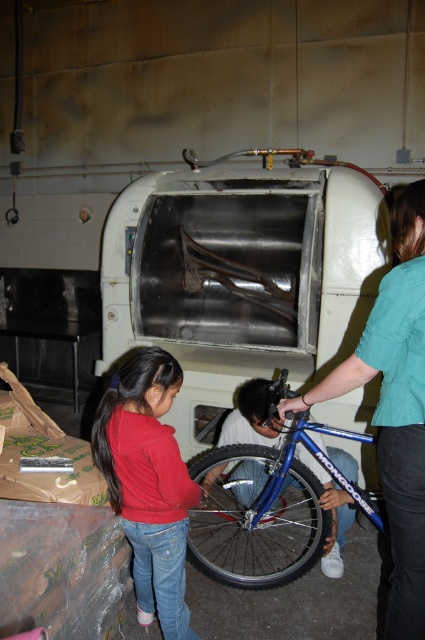
What do you see at coordinates (147, 483) in the screenshot? I see `red matte jacket at lower left` at bounding box center [147, 483].

Can you confirm if red matte jacket at lower left is positioned to the left of blue metallic tire at lower center?

Correct, you'll find red matte jacket at lower left to the left of blue metallic tire at lower center.

Locate an element on the screen. Image resolution: width=425 pixels, height=640 pixels. red matte jacket at lower left is located at coordinates (147, 483).

Does blue metallic bicycle at center come in front of blue metallic tire at lower center?

Yes, it is in front of blue metallic tire at lower center.

Is blue metallic bicycle at center below blue metallic tire at lower center?

Actually, blue metallic bicycle at center is above blue metallic tire at lower center.

The height and width of the screenshot is (640, 425). In order to click on blue metallic bicycle at center in this screenshot , I will do `click(268, 497)`.

Which is in front, point (258, 385) or point (414, 220)?

Point (414, 220)

Is blue metallic bicycle at center further to camera compared to teal fabric shirt at right?

Yes, it is behind teal fabric shirt at right.

The image size is (425, 640). Find the location of `blue metallic bicycle at center`. blue metallic bicycle at center is located at coordinates (268, 497).